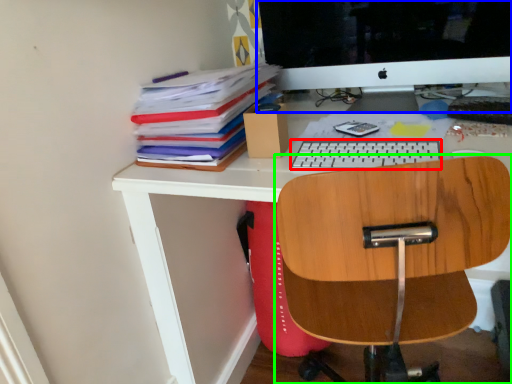
Question: Considering the real-world distances, which object is closest to keyboard (highlighted by a red box)? computer monitor (highlighted by a blue box) or chair (highlighted by a green box).

Choices:
 (A) computer monitor
 (B) chair

Answer: (B)